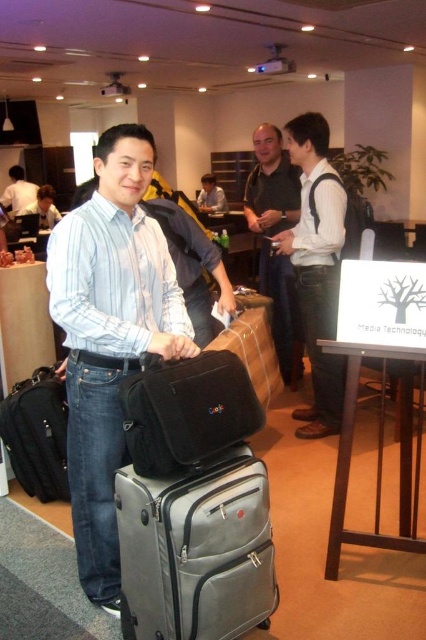
What is the 2D coordinate of the black fabric bag at center?

The black fabric bag at center is located at the 2D coordinate point of (187,412).

You are organizing a clothing display and need to place the matte blue shirt at center and the white matte shirt at upper center on a rack. Which shirt should you place on the wider hanger?

The matte blue shirt at center has a larger width than the white matte shirt at upper center, so it should be placed on the wider hanger.